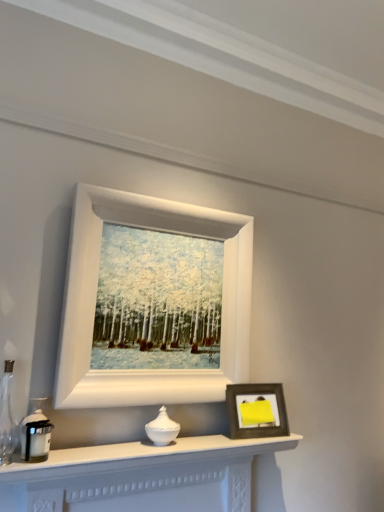
Where is `vacant space situated on the left part of white glossy vase at center, the second candle holder viewed from the front`? vacant space situated on the left part of white glossy vase at center, the second candle holder viewed from the front is located at coordinates (120, 443).